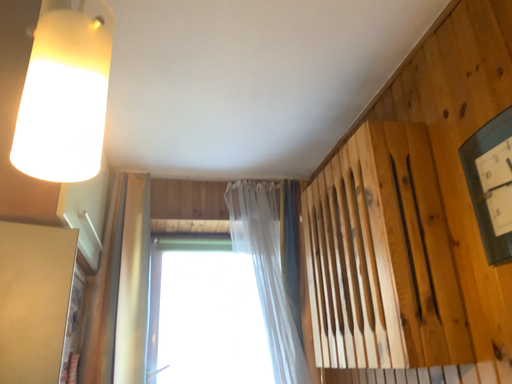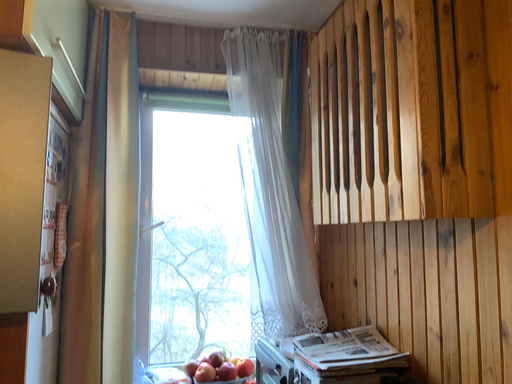
Question: Which way did the camera rotate in the video?

Choices:
 (A) rotated downward
 (B) rotated upward

Answer: (A)